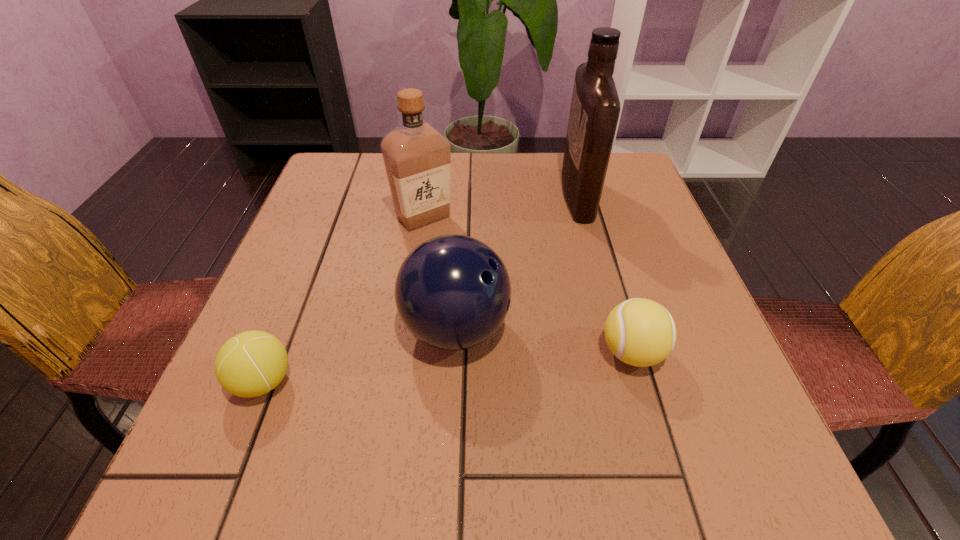
You are a GUI agent. You are given a task and a screenshot of the screen. Output one action in this format:
    pyautogui.click(x=<x>, y=<y>)
    Task: Click on the empty location between the third shortest object and the right liquor
    
    Given the screenshot: What is the action you would take?
    pyautogui.click(x=516, y=262)

Find the location of a particular element. vacant space that is in between the bowling ball and the leftmost object is located at coordinates (359, 355).

Image resolution: width=960 pixels, height=540 pixels. I want to click on object that is the third closest to the second tallest object, so click(x=252, y=363).

Choose which object is the fourth nearest neighbor to the tallest object. Please provide its 2D coordinates. Your answer should be formatted as a tuple, i.e. [(x, y)], where the tuple contains the x and y coordinates of a point satisfying the conditions above.

[(252, 363)]

Identify the location of vacant space that satisfies the following two spatial constraints: 1. on the front-facing side of the left liquor; 2. on the left side of the right tennis ball. click(x=403, y=353).

This screenshot has width=960, height=540. What are the coordinates of `blank area in the image that satisfies the following two spatial constraints: 1. on the surface of the bowling ball near the finger holes; 2. on the front side of the left tennis ball` in the screenshot? It's located at (453, 381).

Where is `free space that satisfies the following two spatial constraints: 1. on the front-facing side of the right tennis ball; 2. on the left side of the fourth shortest object`? This screenshot has height=540, width=960. free space that satisfies the following two spatial constraints: 1. on the front-facing side of the right tennis ball; 2. on the left side of the fourth shortest object is located at coordinates (403, 353).

Identify the location of vacant space that satisfies the following two spatial constraints: 1. on the label side of the tallest object; 2. on the front-facing side of the shorter liquor. (583, 217).

Identify the location of free space that satisfies the following two spatial constraints: 1. on the surface of the third tallest object near the finger holes; 2. on the left side of the right tennis ball. (454, 353).